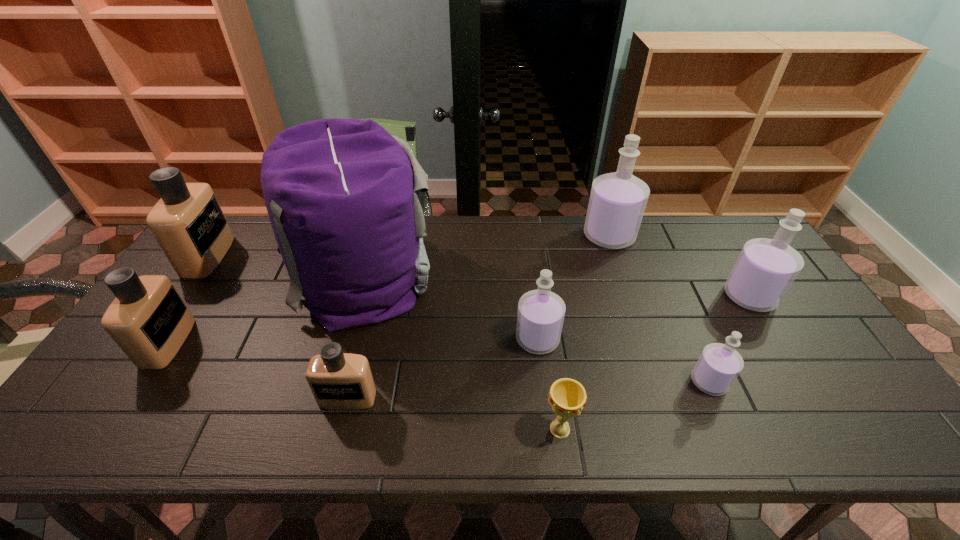
Where is `backpack`? This screenshot has height=540, width=960. backpack is located at coordinates (345, 198).

Identify the location of purple backpack. This screenshot has height=540, width=960. (345, 198).

What are the coordinates of `the biggest purple perfume` in the screenshot? It's located at (617, 202).

Locate an element on the screen. The height and width of the screenshot is (540, 960). the tallest perfume is located at coordinates tap(617, 202).

The height and width of the screenshot is (540, 960). Identify the location of the farthest beige perfume. (188, 223).

At what (x,y) coordinates should I click in order to perform the action: click on the second biggest purple perfume. Please return your answer as a coordinate pair (x, y). The image size is (960, 540). Looking at the image, I should click on (766, 268).

Image resolution: width=960 pixels, height=540 pixels. I want to click on the fifth nearest perfume, so click(x=766, y=268).

What are the coordinates of `the second smallest purple perfume` in the screenshot? It's located at (540, 317).

Identify the location of the leftmost purple perfume. (540, 317).

The height and width of the screenshot is (540, 960). In order to click on the second smallest beige perfume in this screenshot , I will do `click(148, 319)`.